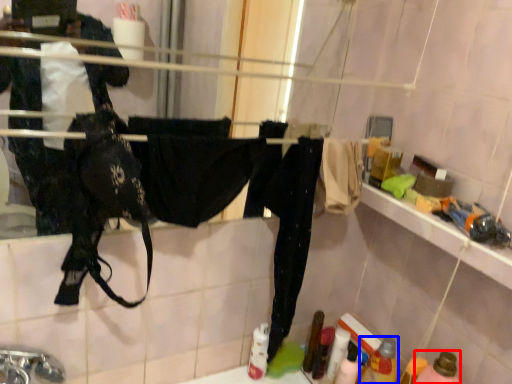
Question: Which point is further to the camera, bottle (highlighted by a red box) or bottle (highlighted by a blue box)?

Choices:
 (A) bottle
 (B) bottle

Answer: (B)